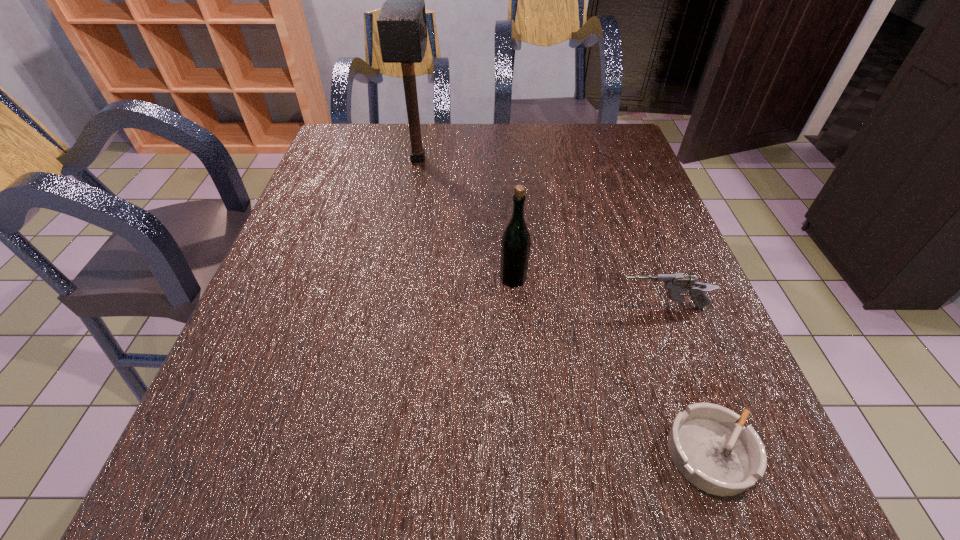
Where is `vacant area at the near edge of the desktop`? Image resolution: width=960 pixels, height=540 pixels. vacant area at the near edge of the desktop is located at coordinates (297, 463).

In the image, there is a desktop. Where is `vacant region at the left edge`? The height and width of the screenshot is (540, 960). vacant region at the left edge is located at coordinates (338, 296).

Where is `free space at the right edge of the desktop`? The height and width of the screenshot is (540, 960). free space at the right edge of the desktop is located at coordinates (650, 234).

You are a GUI agent. You are given a task and a screenshot of the screen. Output one action in this format:
    pyautogui.click(x=<x>, y=<y>)
    Task: Click on the vacant position at the far left corner of the desktop
    
    Given the screenshot: What is the action you would take?
    click(359, 143)

Where is `blank space at the near left corner`? This screenshot has width=960, height=540. blank space at the near left corner is located at coordinates (286, 464).

In the image, there is a desktop. At what (x,y) coordinates should I click in order to perform the action: click on blank space at the far right corner. Please return your answer as a coordinate pair (x, y). The height and width of the screenshot is (540, 960). Looking at the image, I should click on (582, 165).

The width and height of the screenshot is (960, 540). Identify the location of unoccupied area between the nearest object and the farthest object. (564, 306).

Locate an element on the screen. vacant region between the beer bottle and the farthest object is located at coordinates (466, 219).

Locate an element on the screen. The height and width of the screenshot is (540, 960). vacant area between the third shortest object and the tallest object is located at coordinates (466, 219).

The image size is (960, 540). In order to click on free area in between the tallest object and the second shortest object in this screenshot , I will do `click(540, 233)`.